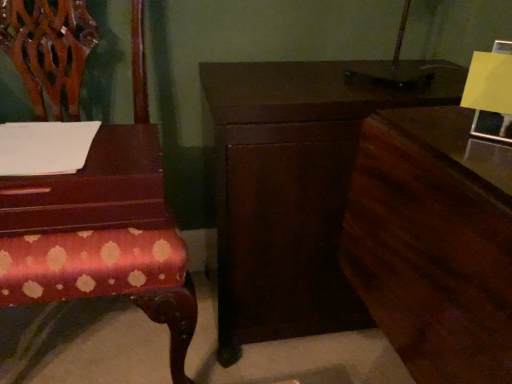
Where is `mahogany wood table at left`? The height and width of the screenshot is (384, 512). mahogany wood table at left is located at coordinates (93, 189).

Measure the distance between dark wood dresser at right and camera.

dark wood dresser at right and camera are 16.91 inches apart from each other.

This screenshot has width=512, height=384. What do you see at coordinates (434, 243) in the screenshot? I see `dark wood dresser at right` at bounding box center [434, 243].

Where is `mahogany wood table at left`? This screenshot has height=384, width=512. mahogany wood table at left is located at coordinates (93, 189).

Is dark wood dresser at right next to dark wood nightstand at center?

No, dark wood dresser at right is not beside dark wood nightstand at center.

From the image's perspective, who appears lower, dark wood dresser at right or dark wood nightstand at center?

dark wood dresser at right.

Which is less distant, (16, 254) or (139, 183)?

Point (16, 254).

What's the angular difference between polished wood chair at left and mahogany wood table at left's facing directions?

polished wood chair at left and mahogany wood table at left are facing 0.522 degrees away from each other.

Considering their positions, is polished wood chair at left located in front of or behind mahogany wood table at left?

Visually, polished wood chair at left is located in front of mahogany wood table at left.

From the image's perspective, is polished wood chair at left located above or below mahogany wood table at left?

Clearly, from the image's perspective, polished wood chair at left is below mahogany wood table at left.

Considering the relative sizes of dark wood nightstand at center and polished wood chair at left in the image provided, is dark wood nightstand at center wider than polished wood chair at left?

No, dark wood nightstand at center is not wider than polished wood chair at left.

Is dark wood nightstand at center beside polished wood chair at left?

dark wood nightstand at center is not next to polished wood chair at left, and they're not touching.

Does dark wood nightstand at center have a lesser height compared to polished wood chair at left?

Yes, dark wood nightstand at center is shorter than polished wood chair at left.

Where is `nightstand on the right of the polished wood chair at left`? This screenshot has width=512, height=384. nightstand on the right of the polished wood chair at left is located at coordinates pos(293,189).

From a real-world perspective, is mahogany wood table at left beneath dark wood dresser at right?

No, from a real-world perspective, mahogany wood table at left is not under dark wood dresser at right.

Between mahogany wood table at left and dark wood dresser at right, which one has smaller width?

Thinner between the two is mahogany wood table at left.

Are mahogany wood table at left and dark wood dresser at right beside each other?

There is a gap between mahogany wood table at left and dark wood dresser at right.

Who is more distant, mahogany wood table at left or dark wood dresser at right?

mahogany wood table at left.

Is mahogany wood table at left shorter than polished wood chair at left?

Indeed, mahogany wood table at left has a lesser height compared to polished wood chair at left.

From the picture: How different are the orientations of mahogany wood table at left and polished wood chair at left in degrees?

There is a 0.522-degree angle between the facing directions of mahogany wood table at left and polished wood chair at left.

Is mahogany wood table at left facing away from polished wood chair at left?

Yes, mahogany wood table at left is facing away from polished wood chair at left.

From the image's perspective, which is below, mahogany wood table at left or dark wood nightstand at center?

From the image's view, dark wood nightstand at center is below.

Between mahogany wood table at left and dark wood nightstand at center, which one is positioned behind?

dark wood nightstand at center is further away from the camera.

Between point (142, 145) and point (249, 85), which one is positioned in front?

Point (142, 145)

Considering the relative sizes of mahogany wood table at left and dark wood nightstand at center in the image provided, is mahogany wood table at left bigger than dark wood nightstand at center?

Incorrect, mahogany wood table at left is not larger than dark wood nightstand at center.

Is polished wood chair at left far from dark wood nightstand at center?

No.

Which of these two, polished wood chair at left or dark wood nightstand at center, is bigger?

polished wood chair at left.

From a real-world perspective, which object rests below the other?

dark wood nightstand at center.

Is polished wood chair at left not within dark wood nightstand at center?

Indeed, polished wood chair at left is completely outside dark wood nightstand at center.

Find the location of `dresser in front of the dark wood nightstand at center`. dresser in front of the dark wood nightstand at center is located at coordinates (434, 243).

Identify the location of table behind the polished wood chair at left. (93, 189).

Based on their spatial positions, is mahogany wood table at left or polished wood chair at left further from dark wood dresser at right?

polished wood chair at left is further to dark wood dresser at right.

Which object lies nearer to the anchor point dark wood nightstand at center, dark wood dresser at right or mahogany wood table at left?

dark wood dresser at right lies closer to dark wood nightstand at center than the other object.

Considering their positions, is dark wood dresser at right positioned closer to dark wood nightstand at center than polished wood chair at left?

dark wood dresser at right lies closer to dark wood nightstand at center than the other object.

Which object lies nearer to the anchor point polished wood chair at left, dark wood dresser at right or dark wood nightstand at center?

dark wood nightstand at center is positioned closer to the anchor polished wood chair at left.

When comparing their distances from dark wood nightstand at center, does mahogany wood table at left or polished wood chair at left seem closer?

Among the two, polished wood chair at left is located nearer to dark wood nightstand at center.

Based on their spatial positions, is dark wood nightstand at center or polished wood chair at left further from dark wood dresser at right?

polished wood chair at left lies further to dark wood dresser at right than the other object.

Based on their spatial positions, is polished wood chair at left or dark wood dresser at right further from mahogany wood table at left?

dark wood dresser at right lies further to mahogany wood table at left than the other object.

From the image, which object appears to be farther from dark wood nightstand at center, polished wood chair at left or mahogany wood table at left?

mahogany wood table at left.

The image size is (512, 384). What are the coordinates of `table between polished wood chair at left and dark wood nightstand at center` in the screenshot? It's located at (93, 189).

At what (x,y) coordinates should I click in order to perform the action: click on table located between polished wood chair at left and dark wood dresser at right in the left-right direction. Please return your answer as a coordinate pair (x, y). Looking at the image, I should click on (93, 189).

The width and height of the screenshot is (512, 384). In order to click on nightstand between mahogany wood table at left and dark wood dresser at right from left to right in this screenshot , I will do `click(293, 189)`.

Find the location of `nightstand between polished wood chair at left and dark wood dresser at right in the horizontal direction`. nightstand between polished wood chair at left and dark wood dresser at right in the horizontal direction is located at coordinates (293, 189).